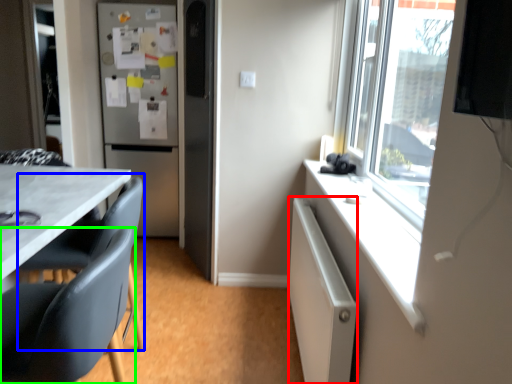
Question: Which object is the closest to the cabinetry (highlighted by a red box)? Choose among these: swivel chair (highlighted by a blue box) or chair (highlighted by a green box).

Choices:
 (A) swivel chair
 (B) chair

Answer: (B)